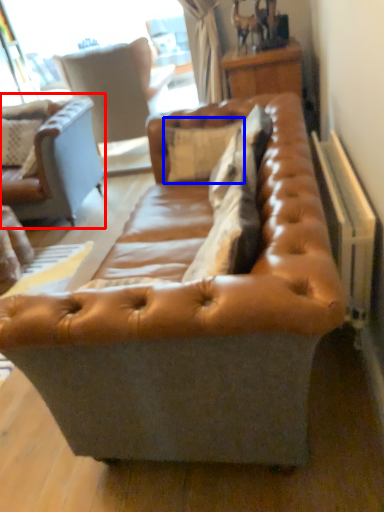
Question: Which of the following is the farthest to the observer, studio couch (highlighted by a red box) or pillow (highlighted by a blue box)?

Choices:
 (A) studio couch
 (B) pillow

Answer: (A)